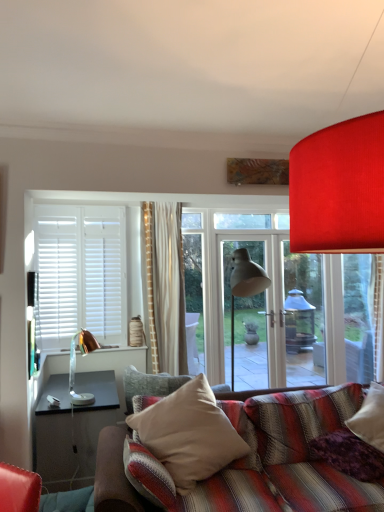
Question: From a real-world perspective, relative to purple soft pillow at lower right, which appears as the first pillow when viewed from the right, is beige fabric pillow at center, which is the 1th pillow in left-to-right order, vertically above or below?

Choices:
 (A) above
 (B) below

Answer: (A)

Question: From the image's perspective, is beige fabric pillow at center, which is the 1th pillow in left-to-right order, positioned above or below purple soft pillow at lower right, the second pillow from the left?

Choices:
 (A) below
 (B) above

Answer: (B)

Question: Which is farther from the purple soft pillow at lower right, which appears as the first pillow when viewed from the right?

Choices:
 (A) copper metallic table lamp at left
 (B) beige fabric pillow at center, which is the 1th pillow in left-to-right order

Answer: (A)

Question: Which object is positioned closest to the copper metallic table lamp at left?

Choices:
 (A) beige fabric pillow at center, which is the 1th pillow in left-to-right order
 (B) purple soft pillow at lower right, the second pillow from the left

Answer: (A)